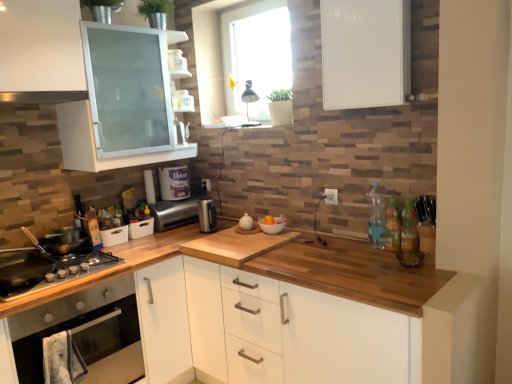
I want to click on vacant area situated to the left side of clear plastic bottle at right, placed as the first bottle when sorted from left to right, so click(343, 251).